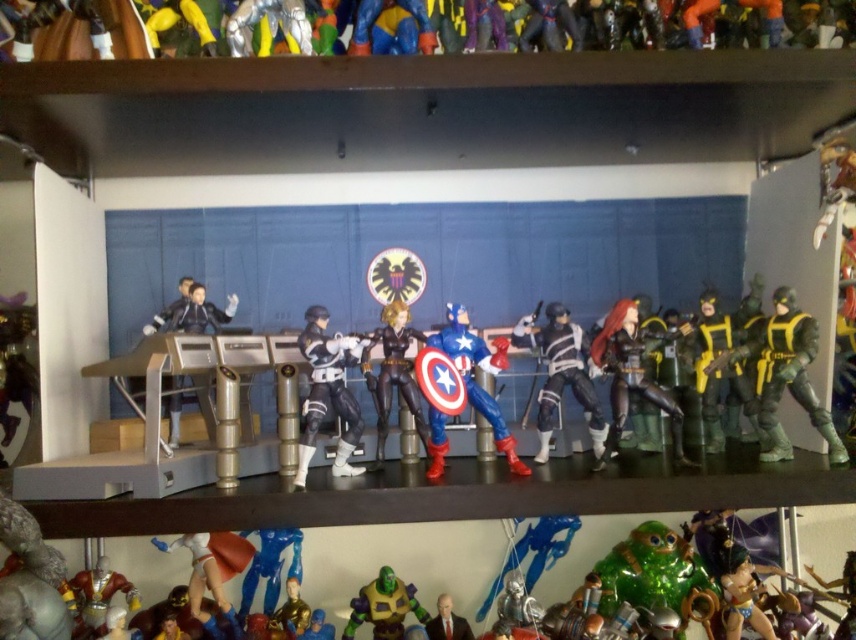
You are arranging action figures on a shelf and want to place a new figure between the green metallic turtle at lower center and the matte black figure at left. Can you fit it there without moving the existing figures?

The green metallic turtle at lower center is positioned on the right side of matte black figure at left, so there is space between them to place a new figure without moving the existing ones.

From the picture: You are an action figure collector who wants to rearrange your shelf. You need to know the relative positions of the matte black figure at left and the green metallic turtle at lower center. Which one is closer to the front of the shelf?

The green metallic turtle at lower center is closer to the front of the shelf because the matte black figure at left is behind it.

You are a collector who wants to place a new 3.5 inch tall action figure on the shelf. The shelf has limited space between the green metallic turtle at lower center and the smooth plastic figure at lower center. Can you fit the new figure between them?

The green metallic turtle at lower center is 10.30 inches away from the smooth plastic figure at lower center. Since the new action figure is only 3.5 inches tall, there is sufficient space between them to accommodate it.